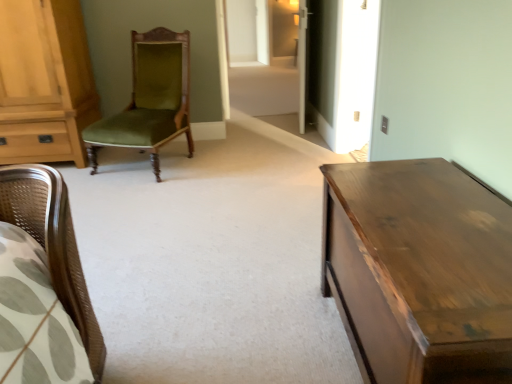
Question: Is shiny brown wooden table at right to the left or to the right of light brown wood cabinet at left in the image?

Choices:
 (A) left
 (B) right

Answer: (B)

Question: Is shiny brown wooden table at right in front of or behind light brown wood cabinet at left in the image?

Choices:
 (A) front
 (B) behind

Answer: (A)

Question: Which object is the closest to the transparent glass door at center?

Choices:
 (A) shiny brown wooden table at right
 (B) light brown wood cabinet at left
 (C) green velvet chair at center

Answer: (C)

Question: Considering the real-world distances, which object is farthest from the shiny brown wooden table at right?

Choices:
 (A) light brown wood cabinet at left
 (B) green velvet chair at center
 (C) transparent glass door at center

Answer: (C)